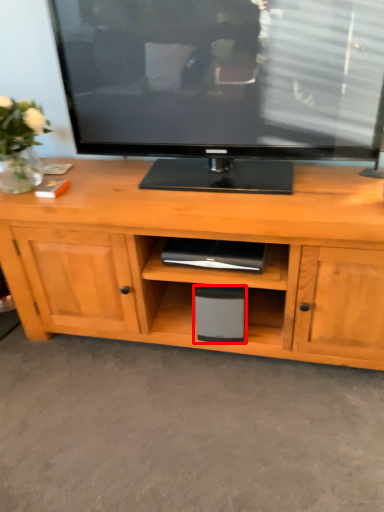
Question: From the image, what is the correct spatial relationship of speaker (annotated by the red box) in relation to plant?

Choices:
 (A) left
 (B) right

Answer: (B)